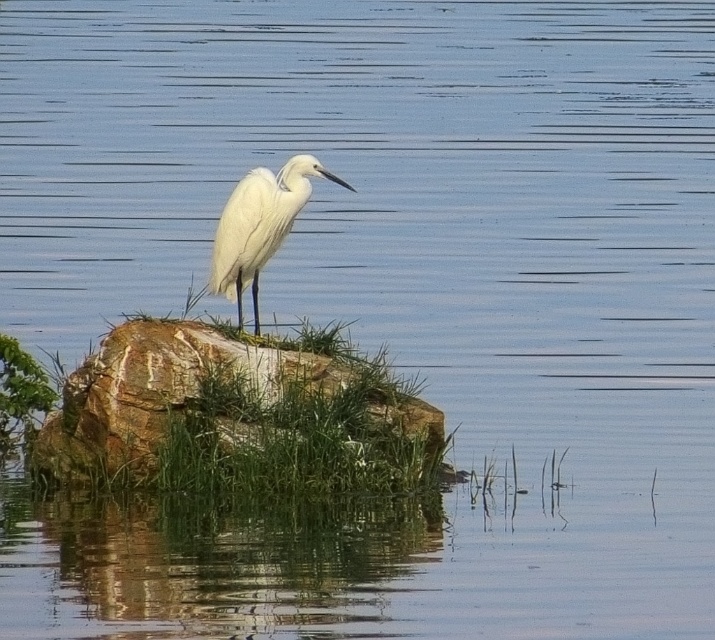
How far apart are brown rough rock at center and white feathered bird at center?

They are 26.21 inches apart.

Can you confirm if brown rough rock at center is positioned to the right of white feathered bird at center?

Incorrect, brown rough rock at center is not on the right side of white feathered bird at center.

Is point (124, 324) farther from camera compared to point (246, 272)?

Yes, point (124, 324) is behind point (246, 272).

Locate an element on the screen. Image resolution: width=715 pixels, height=640 pixels. brown rough rock at center is located at coordinates (154, 392).